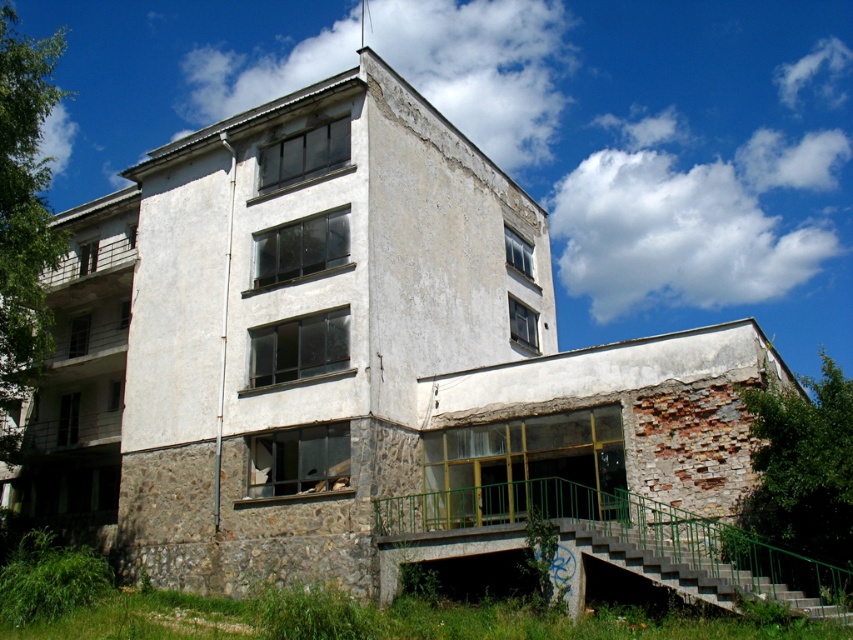
You are standing in front of the old building and notice two points marked on its facade. The first point is at coordinate point (642, 544) and the second is at point (596, 552). Which of these two points is closer to your current position?

Point (642, 544) is closer to your current position because it is further to the viewer than point (596, 552).

You are a painter needing to know which object is wider between the green metal railing at lower center and the concrete stairs at lower right to choose your equipment. Which one is wider?

The green metal railing at lower center is wider than the concrete stairs at lower right according to the description.

From the picture: You are a maintenance worker needing to replace the green metal railing at lower center and the concrete stairs at lower right. Which object requires a taller replacement material?

The green metal railing at lower center requires a taller replacement material since it is taller than the concrete stairs at lower right according to the description.